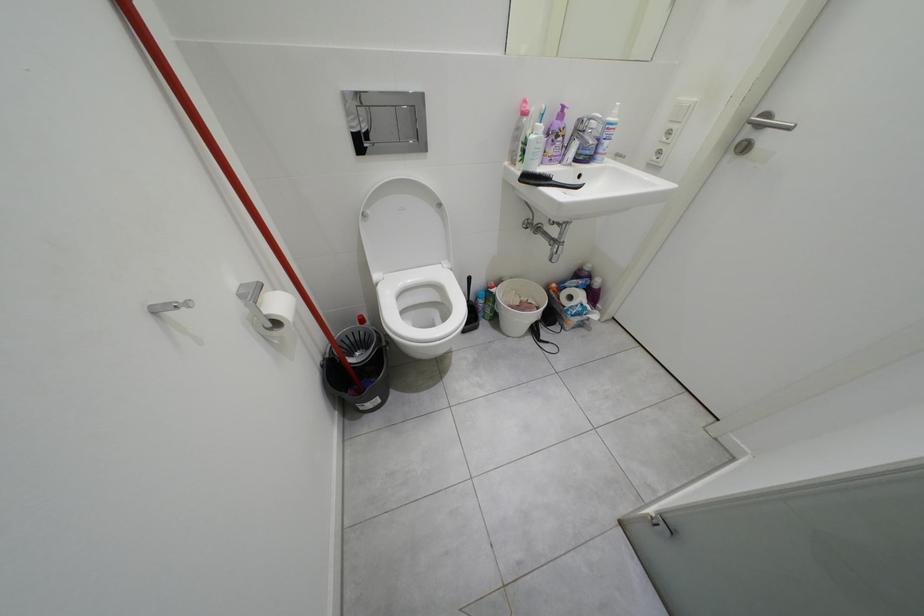
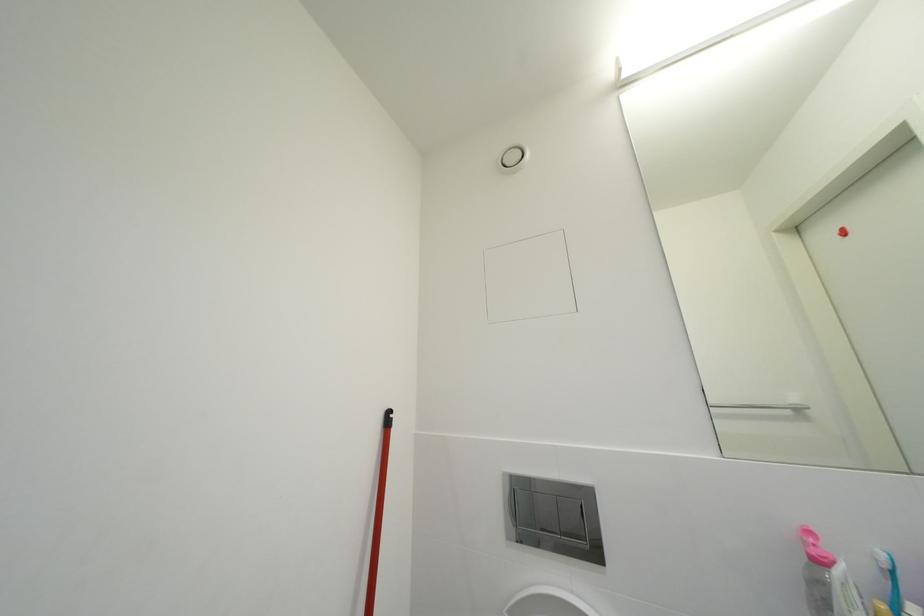
How did the camera likely rotate?

The camera's rotation is toward left-up.